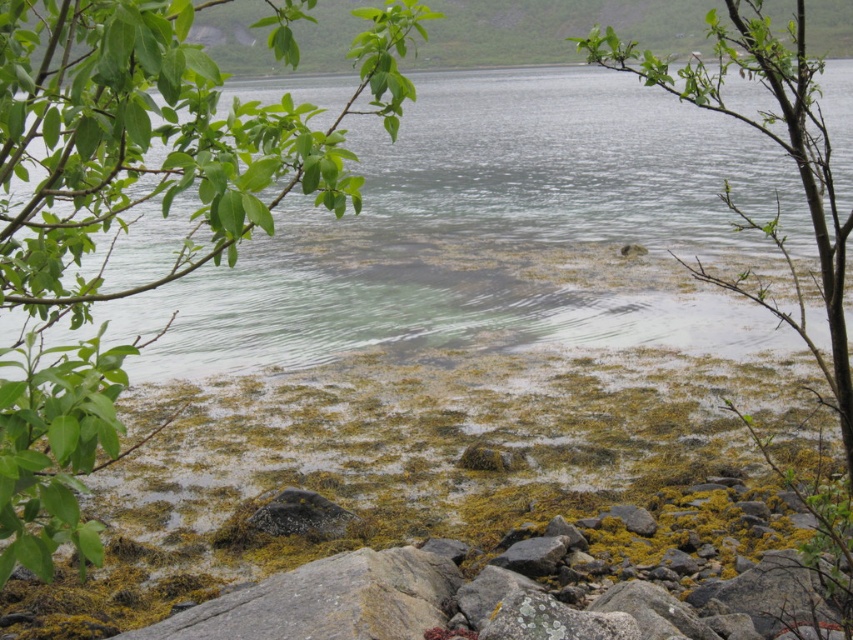
You are a biologist studying aquatic plants in the scene. You observe the green algae at center and the green leafy branch at upper left. Which of these two objects is smaller in size?

The green algae at center is smaller in size compared to the green leafy branch at upper left.

You are a marine biologist studying the lake. You observe the green algae at center. Where exactly is the green algae located in the image?

The green algae at center is located at point 0.361 on the x axis and 0.577 on the y axis.